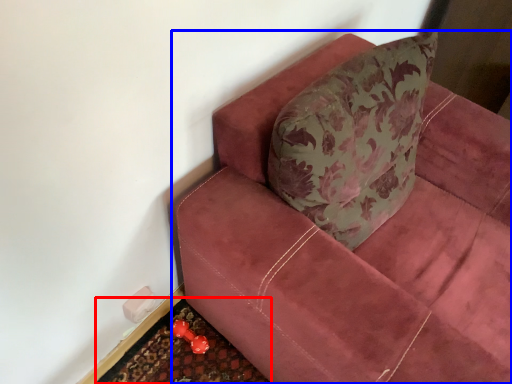
Question: Which point is closer to the camera, doormat (highlighted by a red box) or studio couch (highlighted by a blue box)?

Choices:
 (A) doormat
 (B) studio couch

Answer: (B)